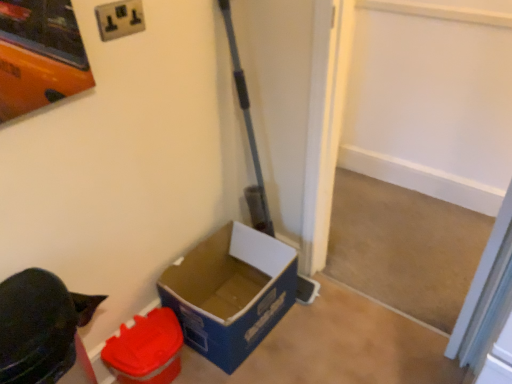
Question: From their relative heights in the image, would you say matte plastic container at lower left, the 1th box viewed from the left, is taller or shorter than blue cardboard box at lower left, arranged as the 1th box when viewed from the right?

Choices:
 (A) tall
 (B) short

Answer: (B)

Question: From a real-world perspective, is matte plastic container at lower left, the second box in the right-to-left sequence, physically located above or below blue cardboard box at lower left, arranged as the 1th box when viewed from the right?

Choices:
 (A) below
 (B) above

Answer: (A)

Question: Estimate the real-world distances between objects in this image. Which object is farther from the matte plastic container at lower left, the second box in the right-to-left sequence?

Choices:
 (A) white plastic electric outlet at upper center
 (B) blue cardboard box at lower left, the 2th box from the left

Answer: (A)

Question: Estimate the real-world distances between objects in this image. Which object is closer to the blue cardboard box at lower left, the 2th box from the left?

Choices:
 (A) white plastic electric outlet at upper center
 (B) matte plastic container at lower left, the 1th box viewed from the left

Answer: (B)